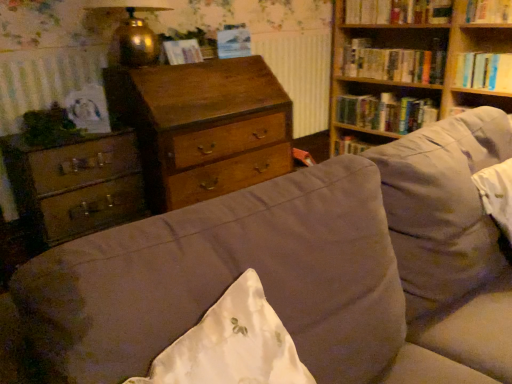
Find the location of a particular element. The width and height of the screenshot is (512, 384). free space in front of matte paper at upper center, which appears as the second paperback book when viewed from the left is located at coordinates (222, 58).